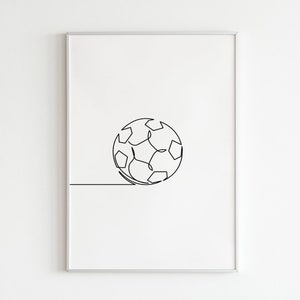
Identify the location of top of painting. (153, 35).